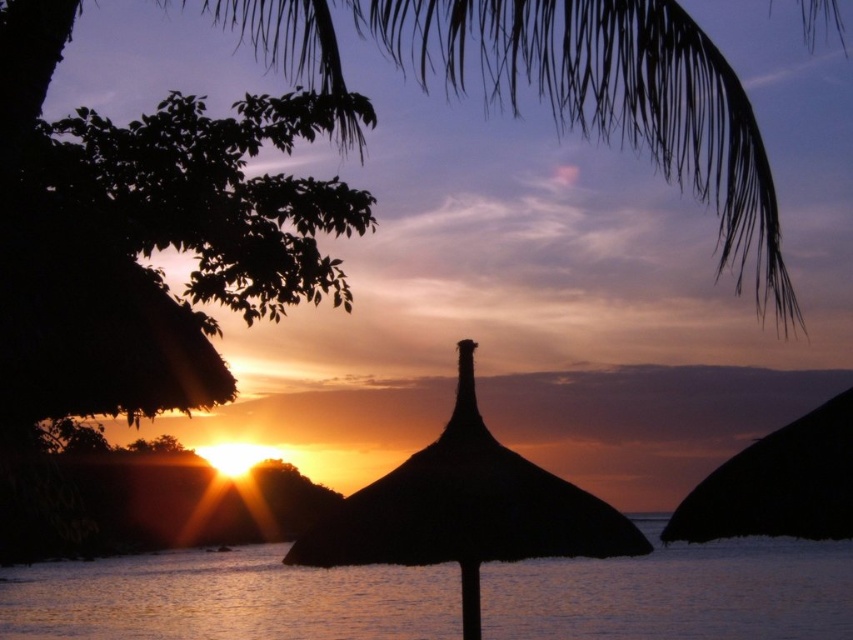
The height and width of the screenshot is (640, 853). Find the location of `glistening water at center`. glistening water at center is located at coordinates (227, 598).

Is point (607, 611) more distant than point (485, 544)?

Yes.

Image resolution: width=853 pixels, height=640 pixels. I want to click on glistening water at center, so click(227, 598).